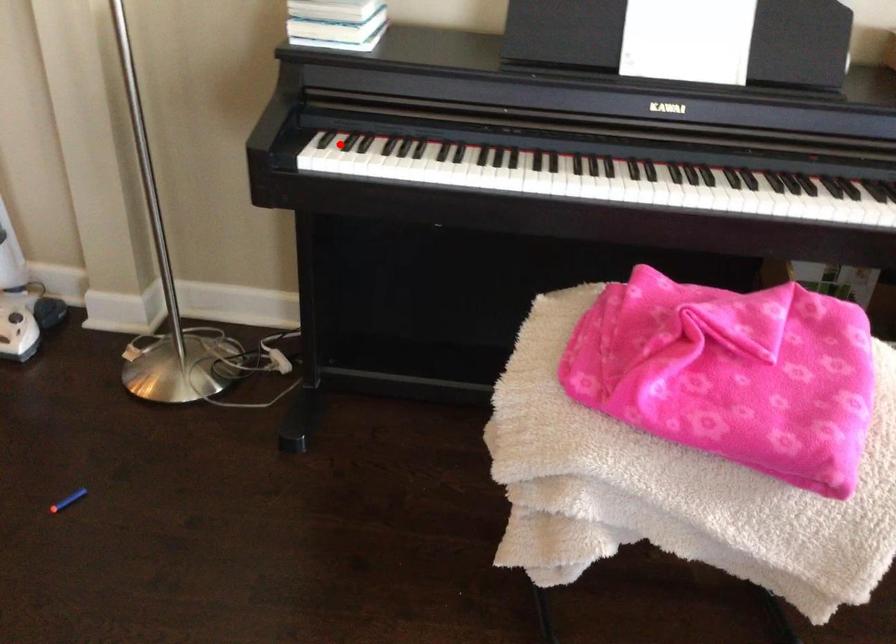
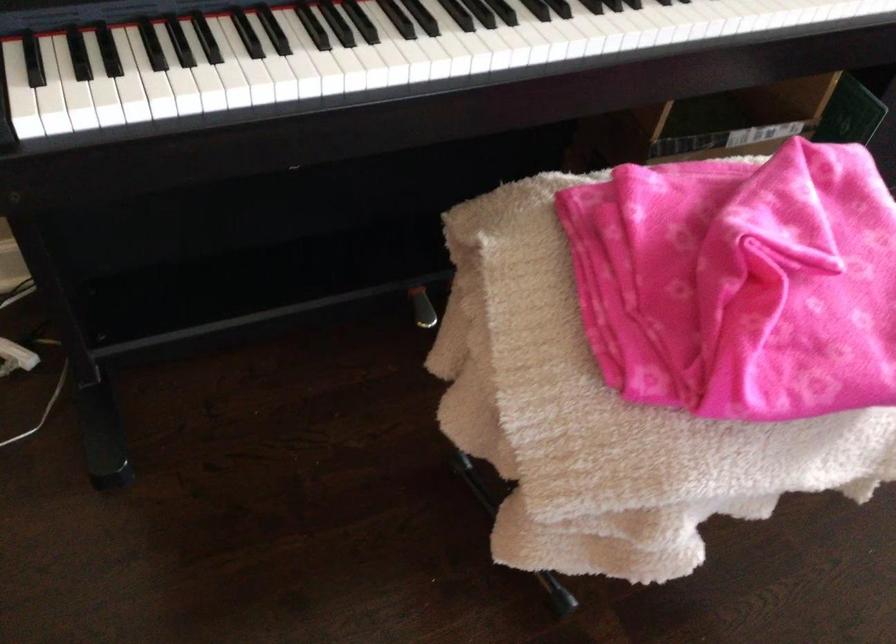
Find the pixel in the second image that matches the highlighted location in the first image.

(87, 80)